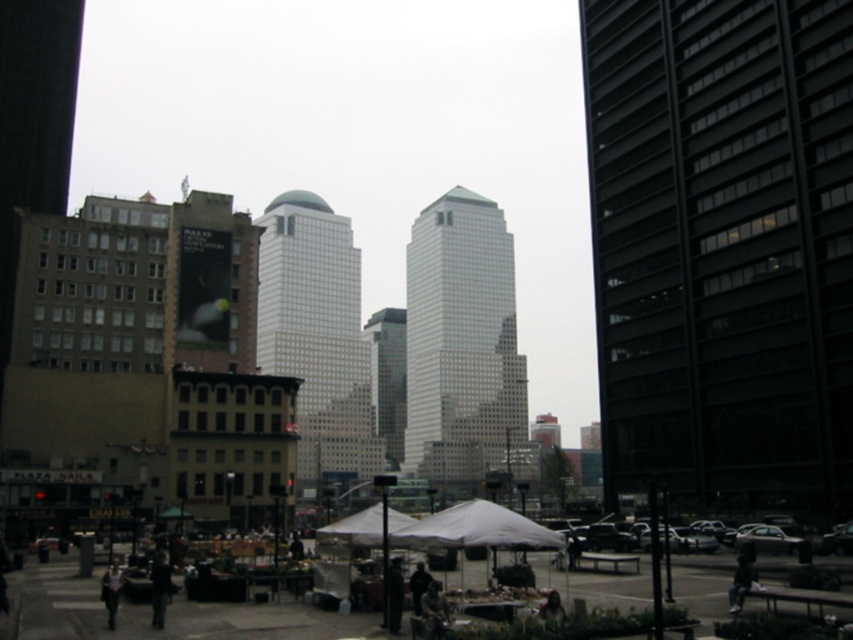
Based on the photo, you are a city planner assessing the urban layout. Considering the dark glass skyscraper at center and the white matte tent at center, which one has a greater width?

The dark glass skyscraper at center has a greater width than the white matte tent at center.

Consider the image. You are a photographer standing in the bustling market area. You want to take a photo of the dark blue jeans at lower right and the green fabric umbrella at center. Which object should you frame first to ensure both are in the shot?

You should frame the green fabric umbrella at center first since the dark blue jeans at lower right is positioned on the right side of it, ensuring both will be included in the photo.